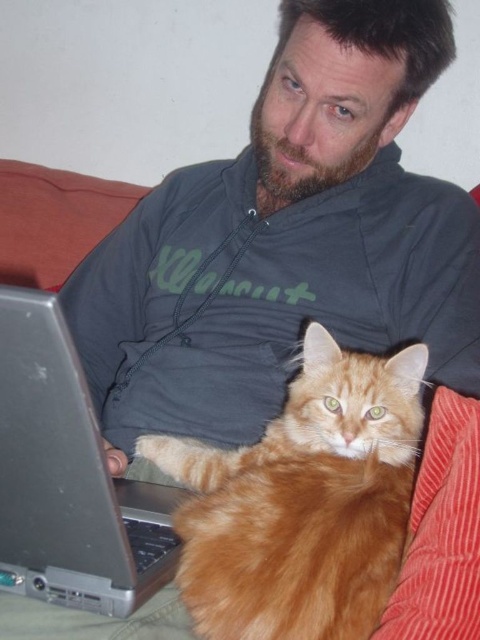
Who is lower down, dark gray hoodie at center or orange fur cat at center?

orange fur cat at center is lower down.

Is dark gray hoodie at center above orange fur cat at center?

Yes, dark gray hoodie at center is above orange fur cat at center.

Is point (148, 234) positioned after point (254, 573)?

Yes, it is.

Locate an element on the screen. dark gray hoodie at center is located at coordinates (286, 241).

Which is below, dark gray hoodie at center or silver metallic laptop at lower left?

Positioned lower is silver metallic laptop at lower left.

Does dark gray hoodie at center have a greater width compared to silver metallic laptop at lower left?

Indeed, dark gray hoodie at center has a greater width compared to silver metallic laptop at lower left.

Is point (412, 52) behind point (146, 502)?

Yes, point (412, 52) is behind point (146, 502).

Identify the location of dark gray hoodie at center. This screenshot has height=640, width=480. (286, 241).

Is orange fur cat at center to the left of silver metallic laptop at lower left from the viewer's perspective?

Incorrect, orange fur cat at center is not on the left side of silver metallic laptop at lower left.

Does point (279, 493) come in front of point (101, 458)?

No, (279, 493) is further to viewer.

Where is `orange fur cat at center`? This screenshot has width=480, height=640. orange fur cat at center is located at coordinates (302, 500).